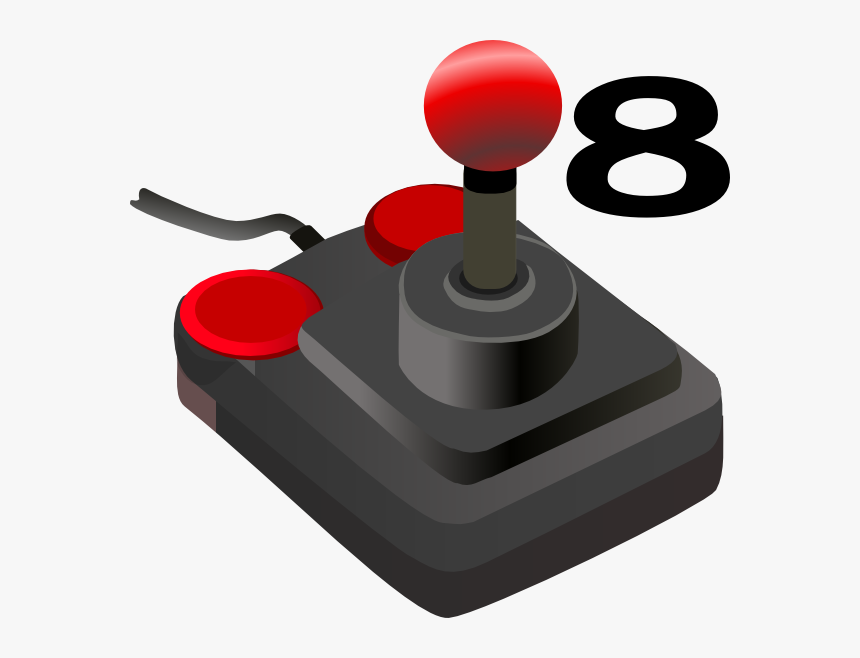
Find the location of a particular element. The image size is (860, 658). cord is located at coordinates (289, 226).